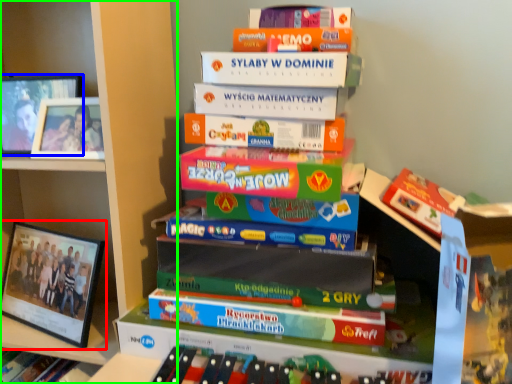
Question: Estimate the real-world distances between objects in this image. Which object is closer to picture frame (highlighted by a red box), picture frame (highlighted by a blue box) or bookcase (highlighted by a green box)?

Choices:
 (A) picture frame
 (B) bookcase

Answer: (B)